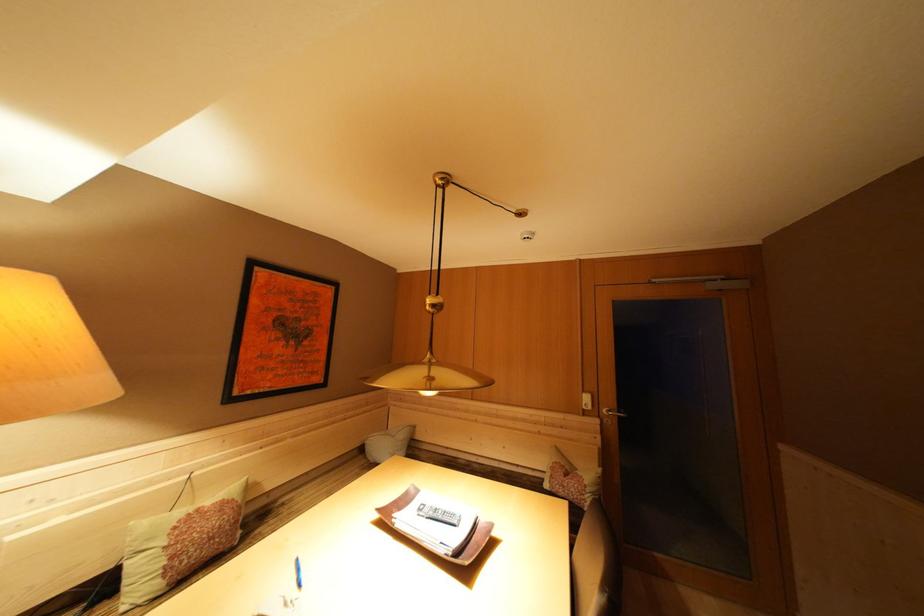
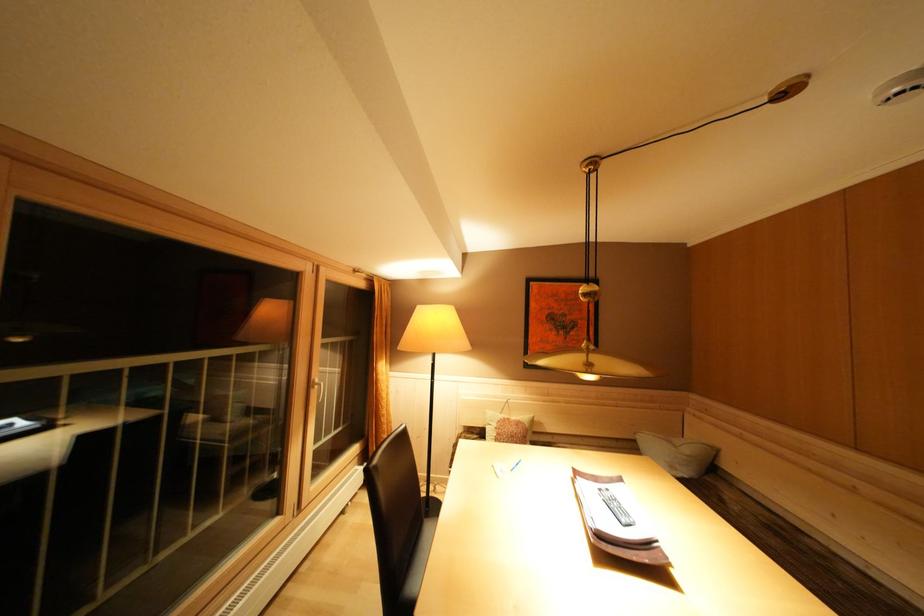
Find the pixel in the second image that matches point 408,440 in the first image.

(695, 456)